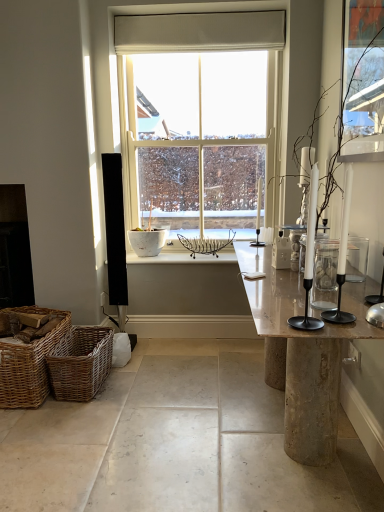
Locate an element on the screen. The height and width of the screenshot is (512, 384). vacant space to the right of woven brown picnic basket at lower left, arranged as the 1th picnic basket when viewed from the right is located at coordinates (138, 388).